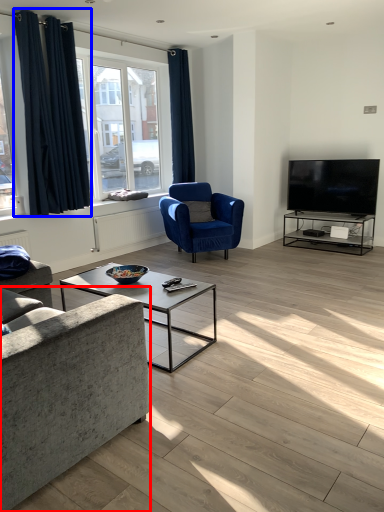
Question: Among these objects, which one is farthest to the camera, studio couch (highlighted by a red box) or curtain (highlighted by a blue box)?

Choices:
 (A) studio couch
 (B) curtain

Answer: (B)